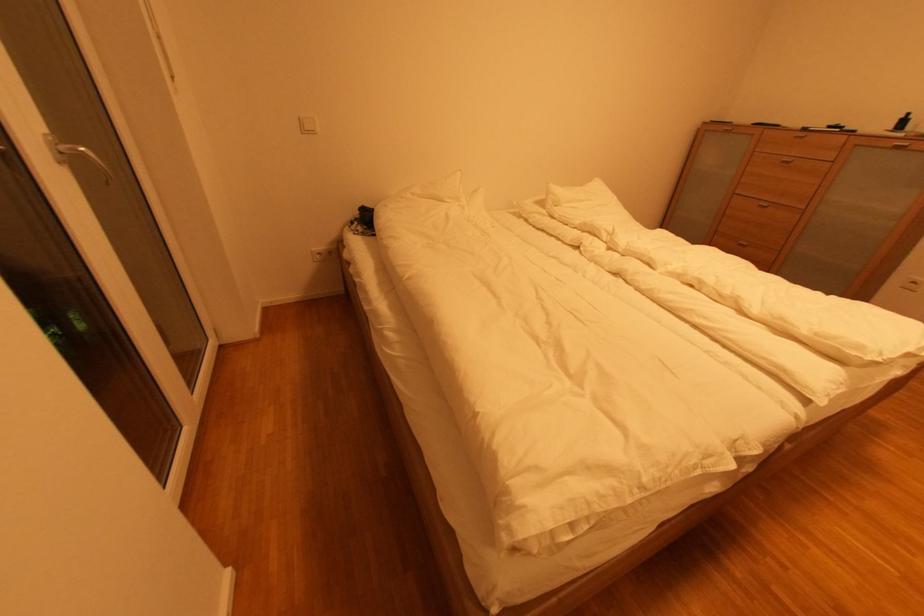
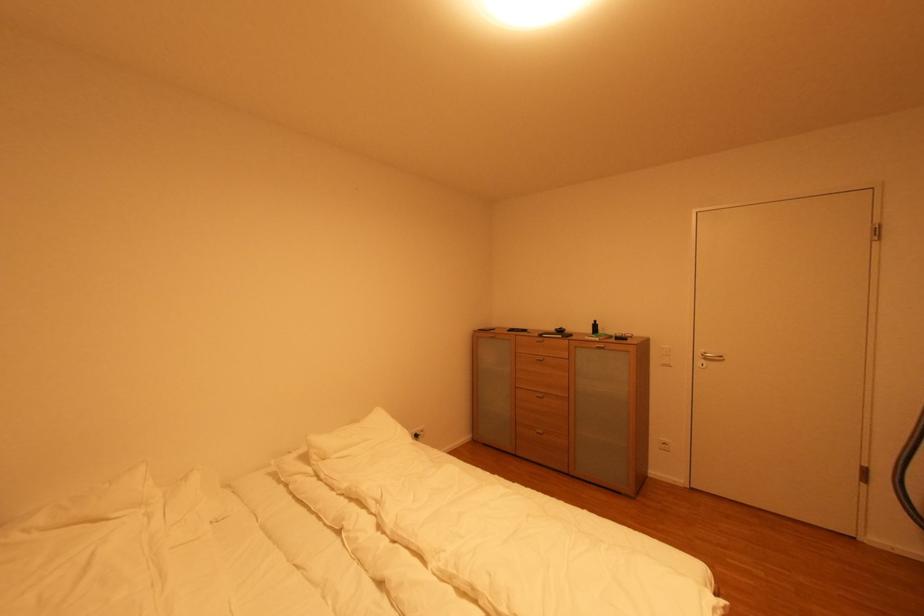
In the second image, find the point that corresponds to [789,163] in the first image.

(543, 361)